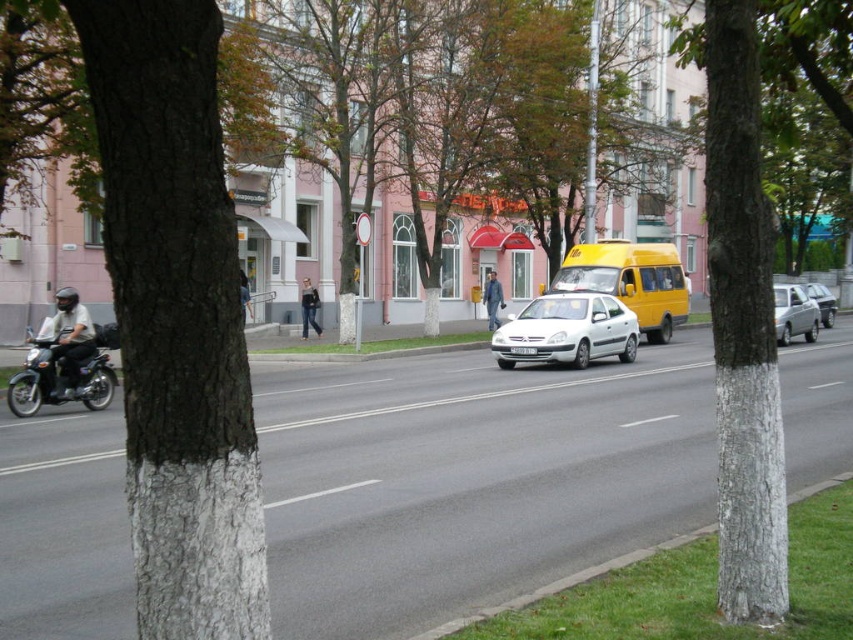
In the scene shown: You are a delivery driver who needs to park your vehicle between the two vehicles shown in the image. The yellow matte van at center is parked on the right side of the road, and the silver metallic sedan at right is driving in the middle lane. Which vehicle should you park behind to ensure you are closer to the sidewalk?

You should park behind the yellow matte van at center because it is closer to the sidewalk than the silver metallic sedan at right, which is further away from the sidewalk.

You are standing at the center of the sidewalk in the street scene. You see two points marked on the road. Which point is closer to you, the point at coordinate (227,564) or the point at (564,355)?

The point at coordinate (227,564) is closer to you than the point at (564,355).

Based on the photo, you are a delivery person who needs to place a package on the sidewalk. The package is 1 meter tall. The smooth bark tree at left and the denim jeans at center are both on the sidewalk. Can the package fit between them?

The smooth bark tree at left is smaller than denim jeans at center, so the space between them may be sufficient for the package. However, without exact measurements of the distance between the two objects, it is uncertain if the 1 meter tall package will fit. Consider checking the actual spacing before placing the package.